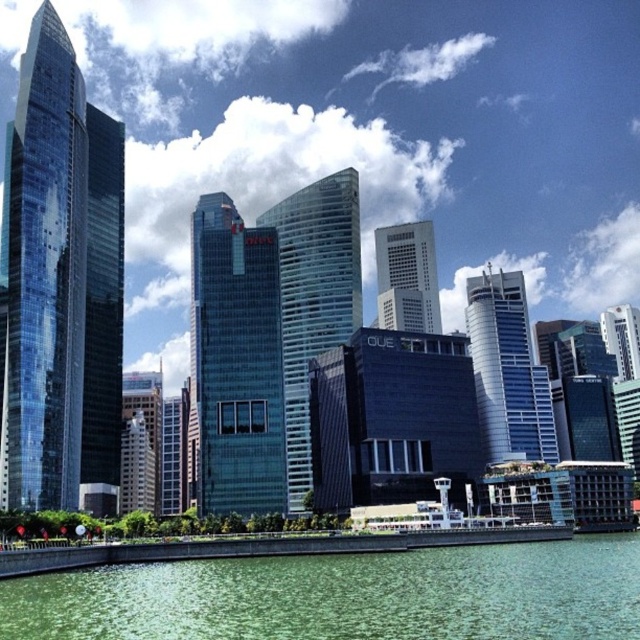
Question: Observing the image, what is the correct spatial positioning of glassy reflective skyscraper at center in reference to glassy skyscraper at center?

Choices:
 (A) below
 (B) above

Answer: (A)

Question: Based on their relative distances, which object is nearer to the glassy blue skyscraper at center?

Choices:
 (A) glassy reflective skyscraper at center
 (B) green water at lower center

Answer: (A)

Question: Is glassy reflective skyscraper at center below glassy reflective skyscraper at left?

Choices:
 (A) yes
 (B) no

Answer: (A)

Question: Which is farther from the glassy reflective skyscraper at center?

Choices:
 (A) glassy skyscraper at center
 (B) glassy blue skyscraper at center
 (C) sleek glass skyscraper at center
 (D) shiny glass skyscraper at left

Answer: (D)

Question: Can you confirm if green water at lower center is positioned to the left of glassy reflective skyscraper at center?

Choices:
 (A) no
 (B) yes

Answer: (A)

Question: Which object is the farthest from the glassy reflective skyscraper at left?

Choices:
 (A) glassy skyscraper at center
 (B) green water at lower center

Answer: (A)